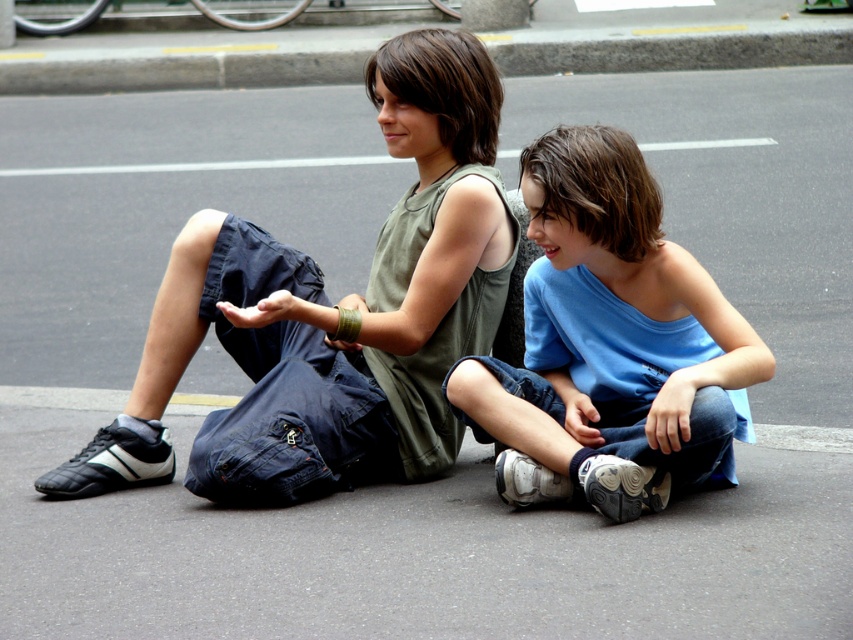
You are a photographer trying to capture a photo of the blue cotton shirt at center and the gray concrete curb at upper center. Based on their positions, which object should you focus on first to ensure both are in the frame?

The blue cotton shirt at center is much taller than the gray concrete curb at upper center, so you should focus on the blue cotton shirt at center first to ensure both are in the frame.